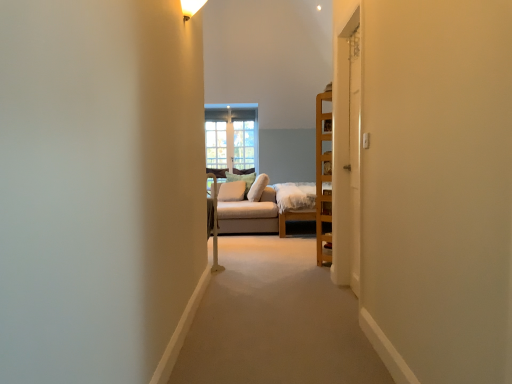
Question: Considering the relative sizes of soft beige cushion at center, which ranks as the 1th pillow in front-to-back order, and soft beige pillow at center, which ranks as the 2th pillow in front-to-back order, in the image provided, is soft beige cushion at center, which ranks as the 1th pillow in front-to-back order, bigger than soft beige pillow at center, which ranks as the 2th pillow in front-to-back order,?

Choices:
 (A) no
 (B) yes

Answer: (A)

Question: Is soft beige cushion at center, marked as the second pillow in a back-to-front arrangement, far away from soft beige pillow at center, which ranks as the 2th pillow in front-to-back order?

Choices:
 (A) yes
 (B) no

Answer: (B)

Question: Is soft beige pillow at center, which ranks as the 2th pillow in front-to-back order, inside soft beige cushion at center, which ranks as the 1th pillow in front-to-back order?

Choices:
 (A) no
 (B) yes

Answer: (A)

Question: Does soft beige cushion at center, which ranks as the 1th pillow in front-to-back order, have a smaller size compared to soft beige pillow at center, which ranks as the 2th pillow in front-to-back order?

Choices:
 (A) yes
 (B) no

Answer: (A)

Question: Is the position of soft beige cushion at center, marked as the second pillow in a back-to-front arrangement, less distant than that of soft beige pillow at center, the first pillow when ordered from back to front?

Choices:
 (A) no
 (B) yes

Answer: (B)

Question: Is soft beige cushion at center, which ranks as the 1th pillow in front-to-back order, turned away from soft beige pillow at center, the first pillow when ordered from back to front?

Choices:
 (A) yes
 (B) no

Answer: (A)

Question: From the image's perspective, does beige fabric couch at center appear lower than soft beige pillow at center, the first pillow when ordered from back to front?

Choices:
 (A) yes
 (B) no

Answer: (A)

Question: From the image's perspective, is beige fabric couch at center above soft beige pillow at center, the first pillow when ordered from back to front?

Choices:
 (A) yes
 (B) no

Answer: (B)

Question: Is the position of beige fabric couch at center less distant than that of soft beige pillow at center, which ranks as the 2th pillow in front-to-back order?

Choices:
 (A) yes
 (B) no

Answer: (A)

Question: Can you confirm if beige fabric couch at center is thinner than soft beige pillow at center, the first pillow when ordered from back to front?

Choices:
 (A) yes
 (B) no

Answer: (B)

Question: Can you confirm if beige fabric couch at center is bigger than soft beige pillow at center, the first pillow when ordered from back to front?

Choices:
 (A) yes
 (B) no

Answer: (A)

Question: Can soft beige pillow at center, which ranks as the 2th pillow in front-to-back order, be found inside beige fabric couch at center?

Choices:
 (A) yes
 (B) no

Answer: (A)

Question: Is white painted wood door at right, positioned as the first door in right-to-left order, facing away from clear glass window at center?

Choices:
 (A) yes
 (B) no

Answer: (B)